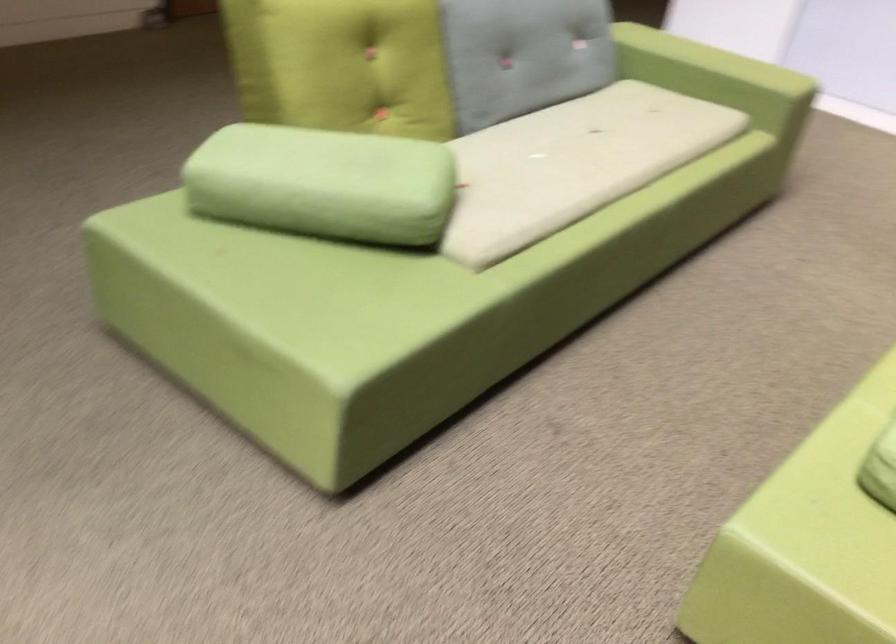
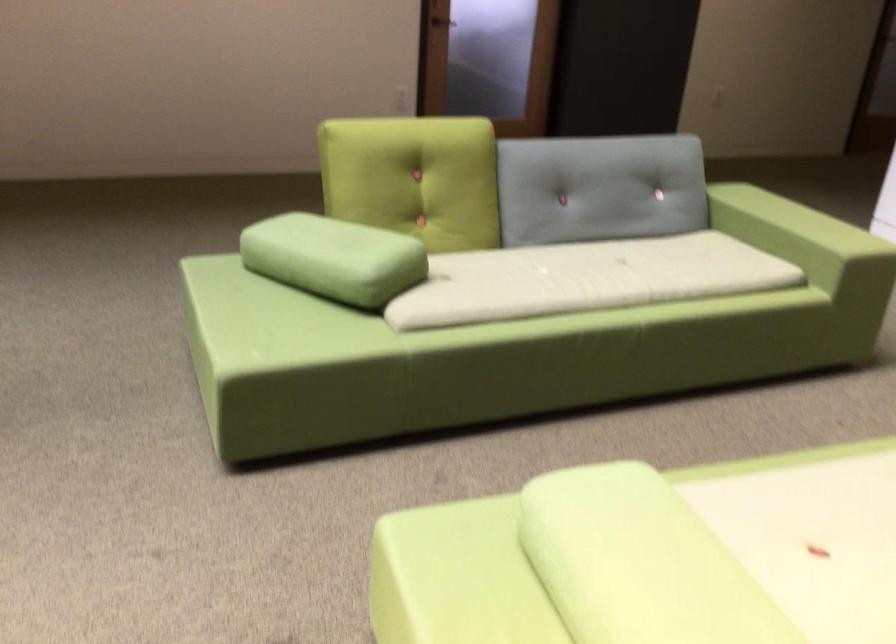
Locate, in the second image, the point that corresponds to [734,80] in the first image.

(794, 241)